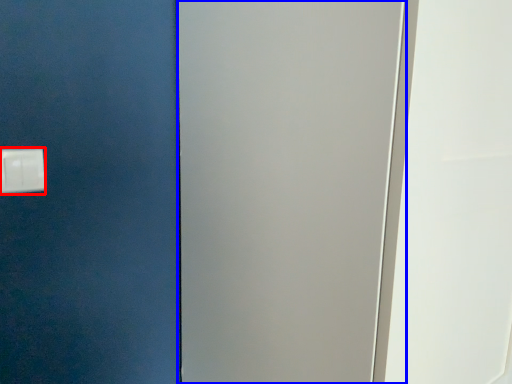
Question: Among these objects, which one is farthest to the camera, light switch (highlighted by a red box) or screen door (highlighted by a blue box)?

Choices:
 (A) light switch
 (B) screen door

Answer: (A)